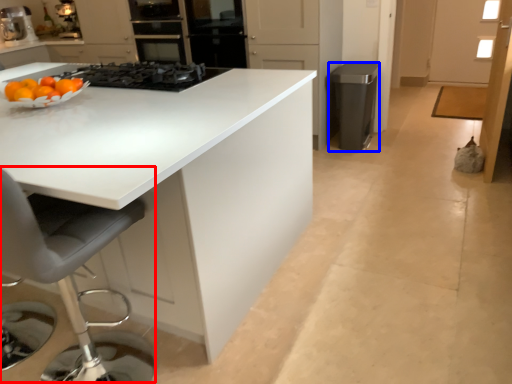
Question: Which of the following is the closest to the observer, swivel chair (highlighted by a red box) or appliance (highlighted by a blue box)?

Choices:
 (A) swivel chair
 (B) appliance

Answer: (A)